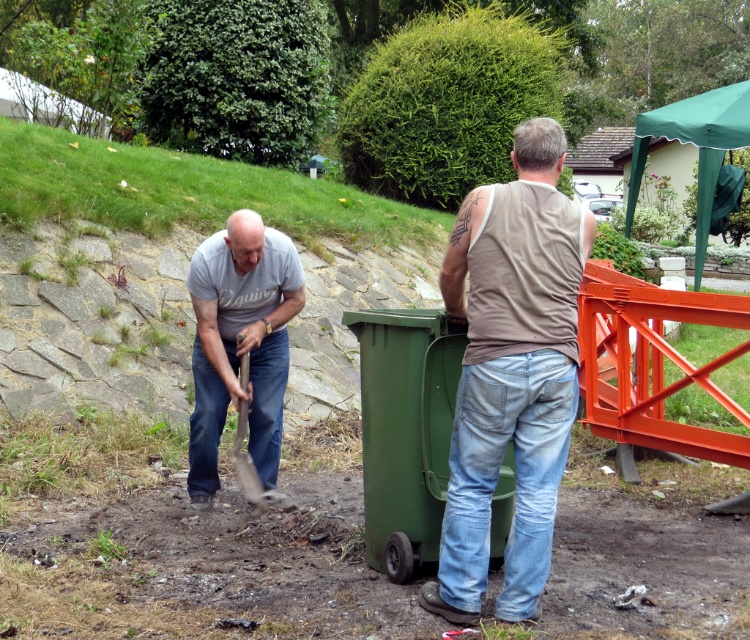
You are standing at point (546, 433) and want to walk to the man on the left using the shortest path. Is there any obstacle between you and him?

The bright orange metal structure is between you and the man on the left, so you cannot walk directly to him without moving the structure.